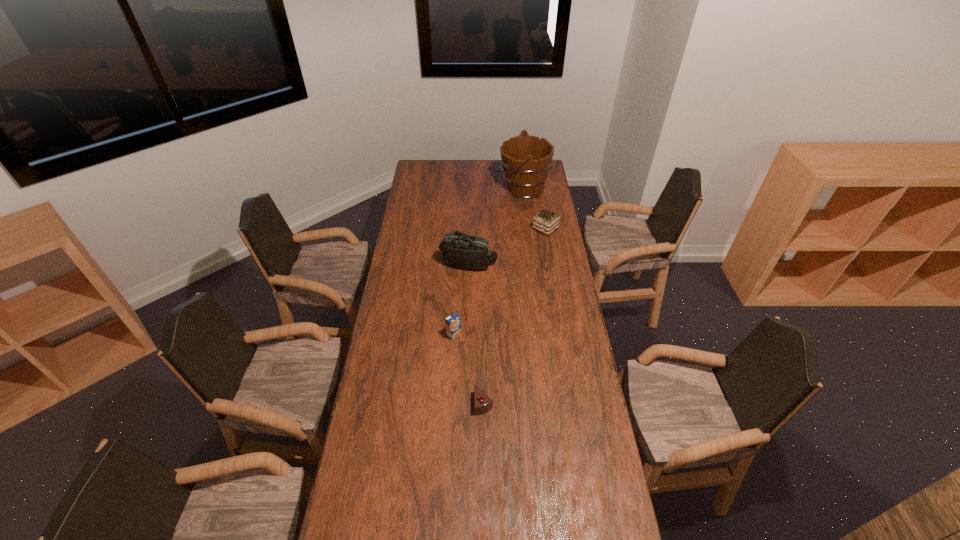
The width and height of the screenshot is (960, 540). I want to click on blank space located with the handle on the wine bucket, so click(x=478, y=188).

The width and height of the screenshot is (960, 540). What are the coordinates of `vacant area situated 0.350m with the handle on the wine bucket` in the screenshot? It's located at (438, 188).

The height and width of the screenshot is (540, 960). Find the location of `blank space located 0.370m at the front padded panel of the shoulder bag`. blank space located 0.370m at the front padded panel of the shoulder bag is located at coordinates (467, 339).

Locate an element on the screen. free spot located 0.200m on the left of the fourth farthest object is located at coordinates (396, 335).

Image resolution: width=960 pixels, height=540 pixels. Find the location of `vacant space located on the front of the taller chocolate cake`. vacant space located on the front of the taller chocolate cake is located at coordinates (548, 244).

Locate an element on the screen. This screenshot has height=540, width=960. vacant area located on the back of the nearer chocolate cake is located at coordinates (483, 318).

At what (x,y) coordinates should I click in order to perform the action: click on object located in the far edge section of the desktop. Please return your answer as a coordinate pair (x, y). This screenshot has height=540, width=960. Looking at the image, I should click on (525, 160).

This screenshot has width=960, height=540. In order to click on wine bucket that is positioned at the right edge in this screenshot , I will do `click(525, 160)`.

Locate an element on the screen. chocolate cake at the right edge is located at coordinates (546, 221).

Find the location of a particular element. object situated at the far right corner is located at coordinates (525, 160).